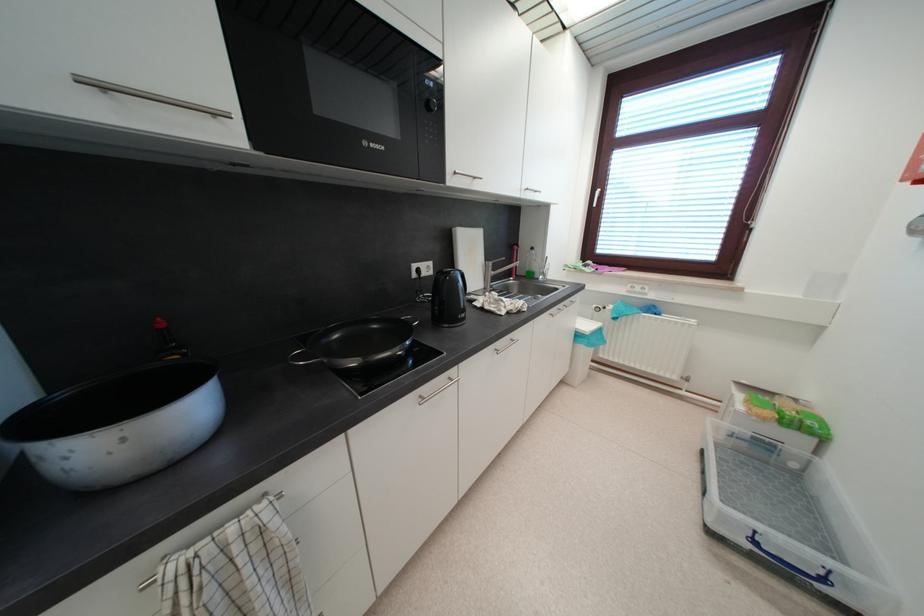
Where is `black kettle handle`? black kettle handle is located at coordinates (464, 282).